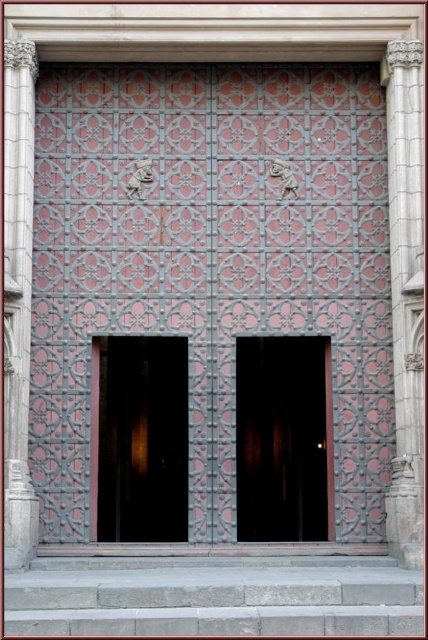
Question: Can you confirm if dark wood door at center is smaller than carved stone column at right?

Choices:
 (A) no
 (B) yes

Answer: (B)

Question: Which point appears closest to the camera in this image?

Choices:
 (A) (9, 497)
 (B) (279, 387)
 (C) (42, 96)
 (D) (155, 444)

Answer: (A)

Question: Which is farther from the carved stone column at right?

Choices:
 (A) metallic gray doors at center
 (B) gray stone pillar at left
 (C) metallic glass door at center

Answer: (B)

Question: Is the position of metallic glass door at center more distant than that of gray stone pillar at left?

Choices:
 (A) no
 (B) yes

Answer: (B)

Question: Does metallic glass door at center appear under gray stone pillar at left?

Choices:
 (A) no
 (B) yes

Answer: (B)

Question: Which point is farther to the camera?

Choices:
 (A) dark wood door at center
 (B) metallic gray doors at center
 (C) gray stone pillar at left

Answer: (A)